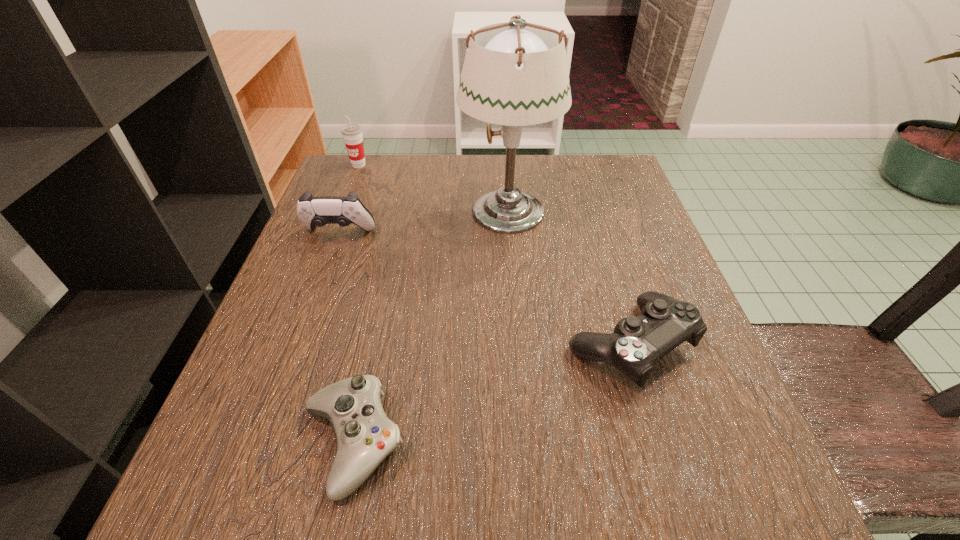
Image resolution: width=960 pixels, height=540 pixels. What are the coordinates of `the tallest object` in the screenshot? It's located at (515, 74).

Find the location of `the fourth shortest object`. the fourth shortest object is located at coordinates (352, 134).

Where is `the farthest object`? Image resolution: width=960 pixels, height=540 pixels. the farthest object is located at coordinates (352, 134).

Locate an element on the screen. This screenshot has width=960, height=540. the farthest control is located at coordinates (312, 211).

In order to click on the rightmost control in this screenshot , I will do `click(637, 343)`.

Image resolution: width=960 pixels, height=540 pixels. I want to click on the shortest control, so click(x=364, y=435).

The width and height of the screenshot is (960, 540). I want to click on vacant region located 0.250m on the lampshade of the tallest object, so click(348, 210).

Image resolution: width=960 pixels, height=540 pixels. Identify the location of vacant space located on the lampshade of the tallest object. (384, 210).

Locate an element on the screen. Image resolution: width=960 pixels, height=540 pixels. vacant space located 0.180m on the lampshade of the tallest object is located at coordinates (379, 210).

Identify the location of free space located 0.390m on the side of the farthest object with the logo. Image resolution: width=960 pixels, height=540 pixels. (315, 278).